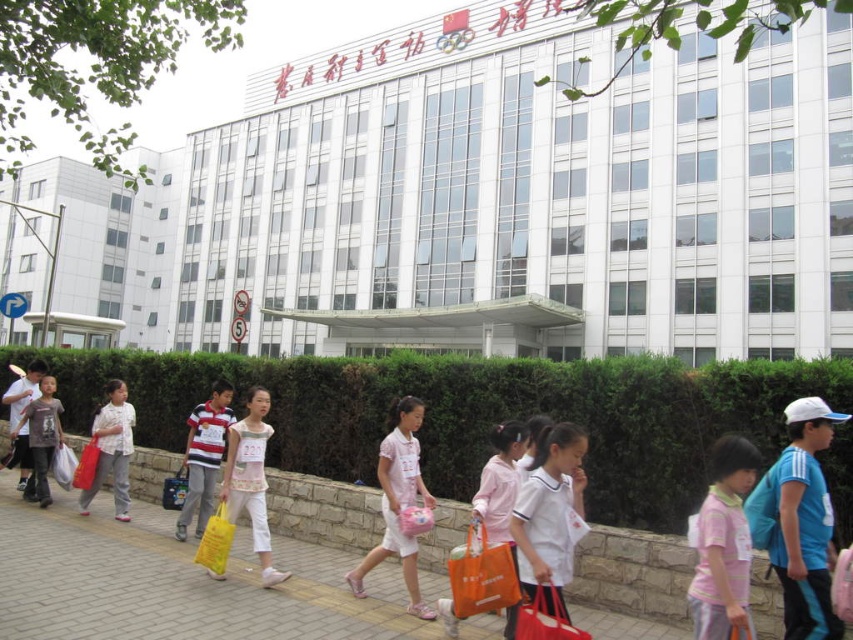
Which is more to the right, brick pavement at center or matte gray shirt at left?

brick pavement at center is more to the right.

What are the coordinates of `brick pavement at center` in the screenshot? It's located at click(172, 582).

Between point (114, 628) and point (39, 483), which one is positioned behind?

The point (39, 483) is more distant.

Find the location of a particular element. This screenshot has width=853, height=640. brick pavement at center is located at coordinates (172, 582).

Does point (570, 490) come farther from viewer compared to point (44, 384)?

No, (570, 490) is in front of (44, 384).

Is white cotton shirt at center to the right of matte gray shirt at left from the viewer's perspective?

Yes, white cotton shirt at center is to the right of matte gray shirt at left.

Between point (581, 456) and point (44, 387), which one is positioned behind?

Point (44, 387)

You are a GUI agent. You are given a task and a screenshot of the screen. Output one action in this format:
    pyautogui.click(x=<x>, y=<y>)
    Task: Click on the white cotton shirt at center
    This screenshot has width=853, height=640.
    Given the screenshot: What is the action you would take?
    pyautogui.click(x=550, y=516)

Can you confirm if orange plastic bag at center is positioned below matte gray shirt at left?

Correct, orange plastic bag at center is located below matte gray shirt at left.

The width and height of the screenshot is (853, 640). Describe the element at coordinates (482, 576) in the screenshot. I see `orange plastic bag at center` at that location.

Where is `orange plastic bag at center`? This screenshot has height=640, width=853. orange plastic bag at center is located at coordinates (482, 576).